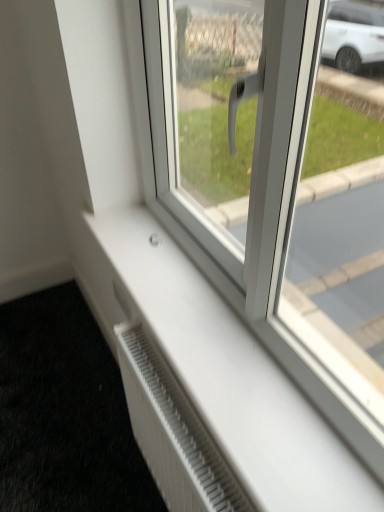
Question: From a real-world perspective, is white plastic window at center positioned above or below white textured radiator at lower left?

Choices:
 (A) below
 (B) above

Answer: (B)

Question: Based on their positions, is white plastic window at center located to the left or right of white textured radiator at lower left?

Choices:
 (A) right
 (B) left

Answer: (A)

Question: Estimate the real-world distances between objects in this image. Which object is closer to the white plastic radiator at lower center?

Choices:
 (A) white plastic window at center
 (B) white textured radiator at lower left

Answer: (A)

Question: Which is farther from the white plastic window at center?

Choices:
 (A) white textured radiator at lower left
 (B) white plastic radiator at lower center

Answer: (A)